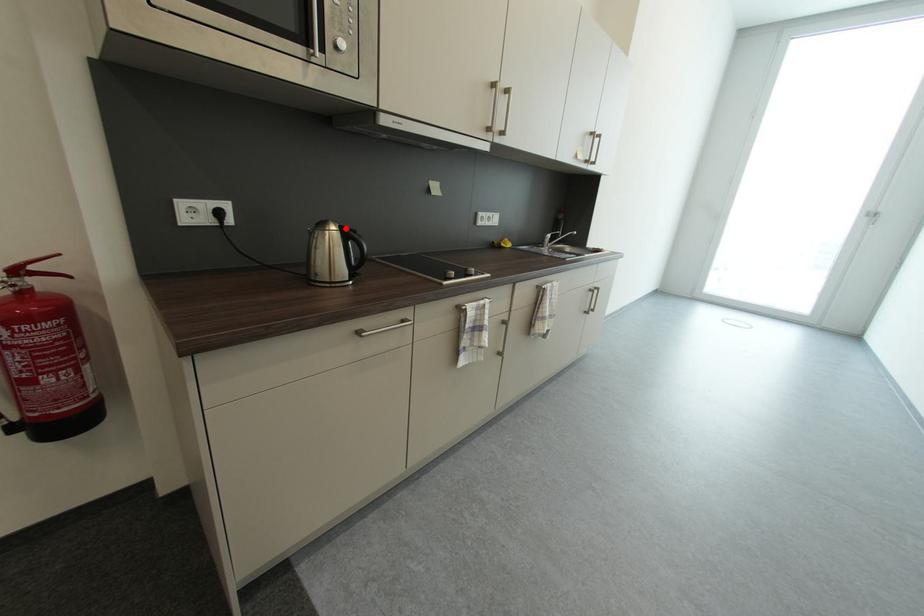
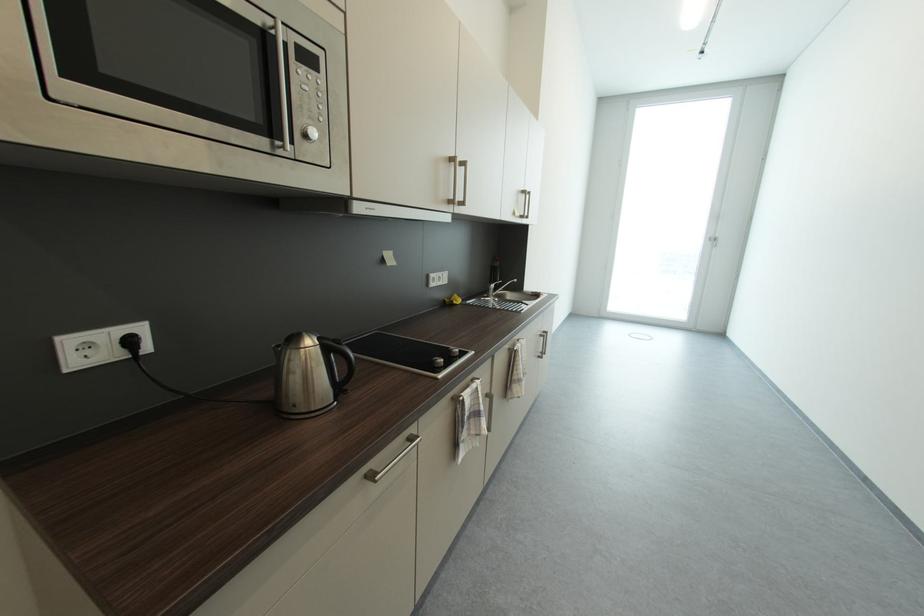
Locate, in the second image, the point that corresponds to the highlighted location in the first image.

(323, 342)